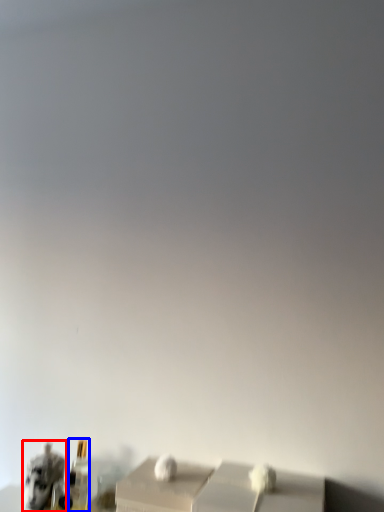
Question: Among these objects, which one is farthest to the camera, animal (highlighted by a red box) or bottle (highlighted by a blue box)?

Choices:
 (A) animal
 (B) bottle

Answer: (B)